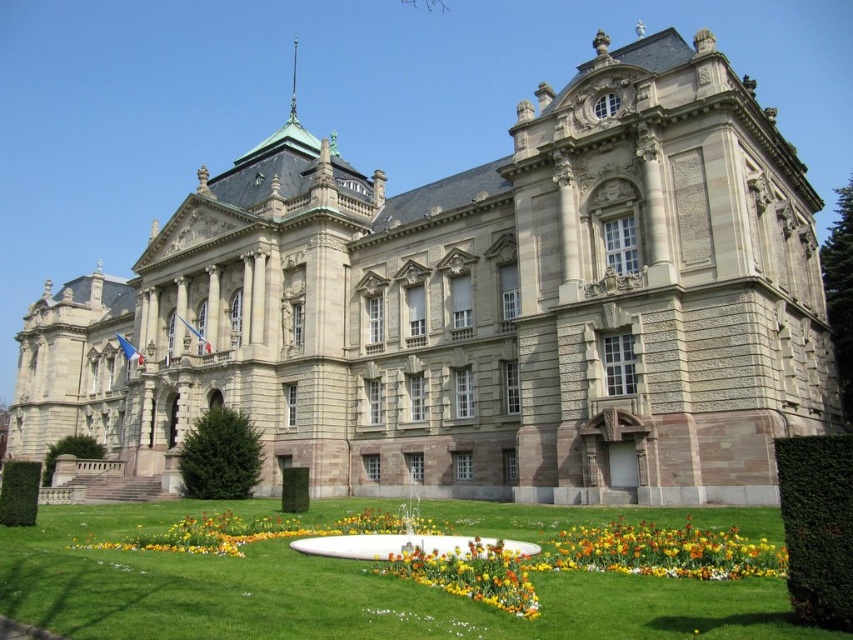
Question: Which object is positioned closest to the vibrant multicolored petals at lower center?

Choices:
 (A) green grass at center
 (B) multicolored fabric flower bed at center

Answer: (B)

Question: Does green grass at center appear under vibrant multicolored petals at lower center?

Choices:
 (A) yes
 (B) no

Answer: (A)

Question: Is green grass at center above multicolored fabric flower bed at center?

Choices:
 (A) yes
 (B) no

Answer: (B)

Question: Which is nearer to the vibrant multicolored petals at lower center?

Choices:
 (A) green grass at center
 (B) multicolored fabric flower bed at center

Answer: (B)

Question: Estimate the real-world distances between objects in this image. Which object is closer to the vibrant multicolored petals at lower center?

Choices:
 (A) multicolored fabric flower bed at center
 (B) green grass at center

Answer: (A)

Question: In this image, where is green grass at center located relative to vibrant multicolored petals at lower center?

Choices:
 (A) below
 (B) above

Answer: (A)